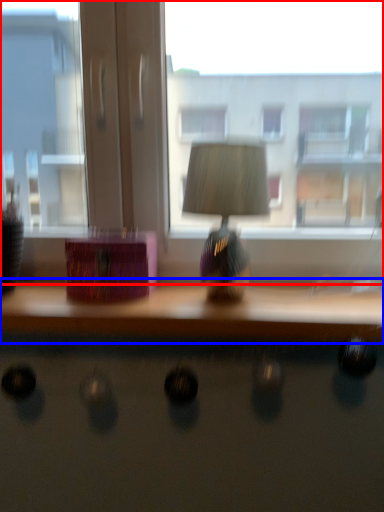
Question: Among these objects, which one is farthest to the camera, window (highlighted by a red box) or table (highlighted by a blue box)?

Choices:
 (A) window
 (B) table

Answer: (A)